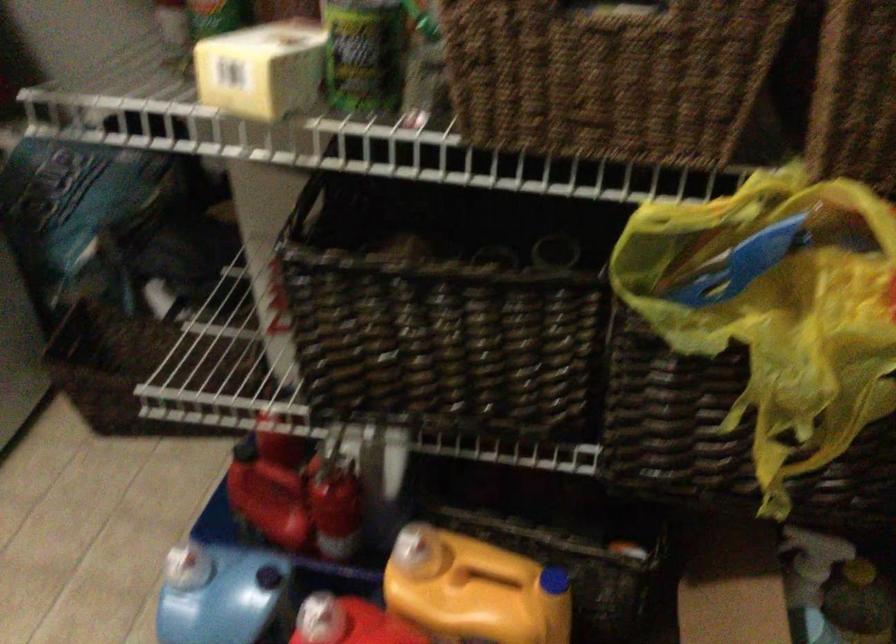
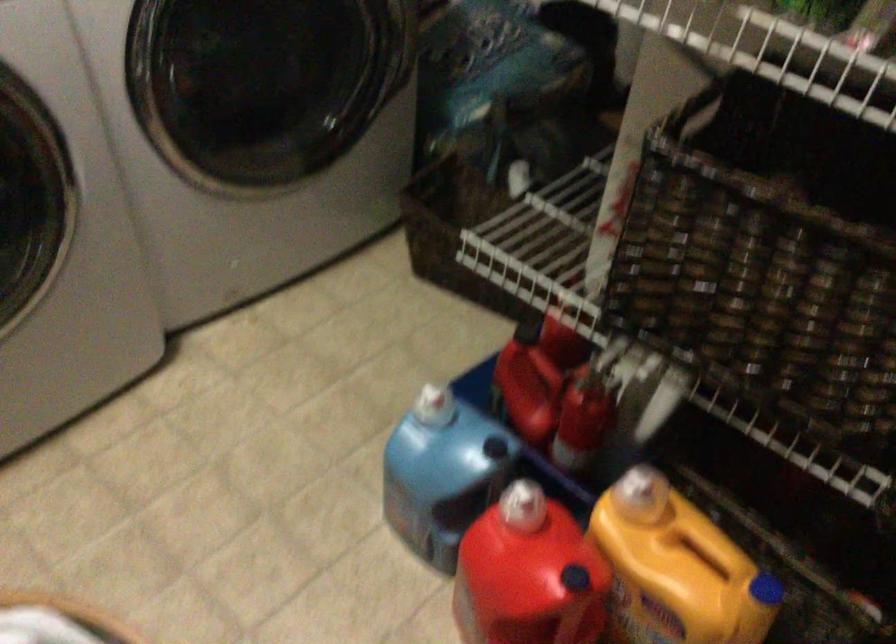
Question: Based on the continuous images, in which direction is the camera rotating? Reply with the corresponding letter.

Choices:
 (A) Left
 (B) Right
 (C) Up
 (D) Down

Answer: (A)